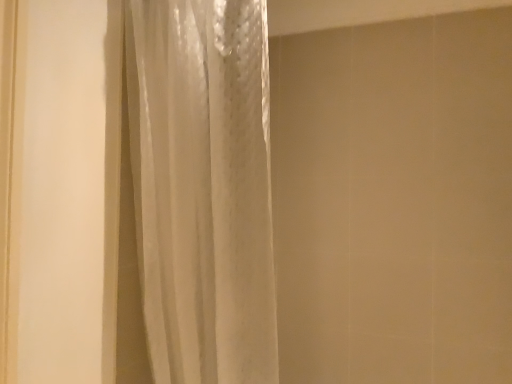
Image resolution: width=512 pixels, height=384 pixels. I want to click on white sheer curtain at left, so click(203, 187).

Measure the distance between point (x=133, y=25) and camera.

Point (x=133, y=25) is 4.01 feet from camera.

The image size is (512, 384). What do you see at coordinates (203, 187) in the screenshot?
I see `white sheer curtain at left` at bounding box center [203, 187].

This screenshot has height=384, width=512. In order to click on white sheer curtain at left in this screenshot , I will do `click(203, 187)`.